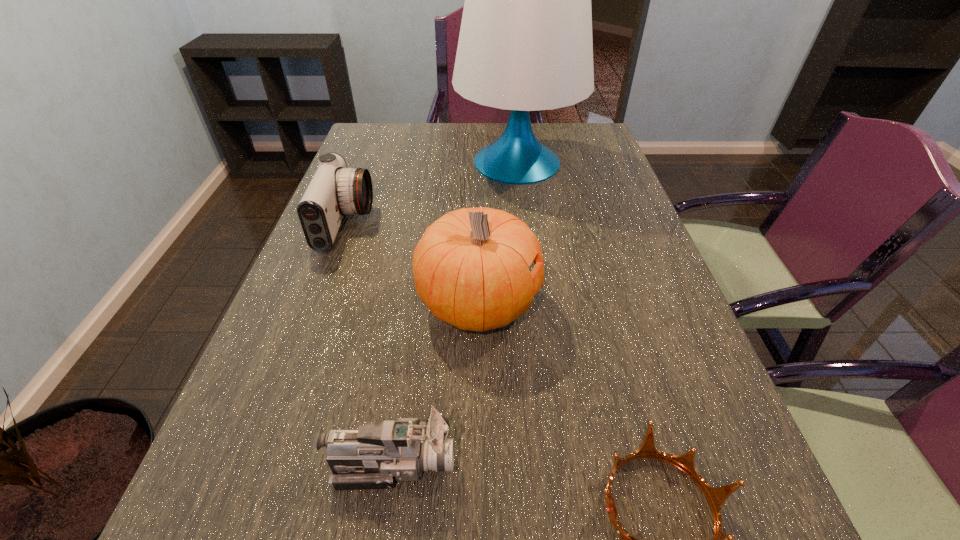
I want to click on vacant area that lies between the pumpkin and the fourth tallest object, so click(435, 383).

Locate an element on the screen. free point between the taller camcorder and the second shortest object is located at coordinates (369, 344).

At what (x,y) coordinates should I click in order to perform the action: click on free space between the farther camcorder and the nearer camcorder. Please return your answer as a coordinate pair (x, y). Image resolution: width=960 pixels, height=540 pixels. Looking at the image, I should click on (369, 344).

The width and height of the screenshot is (960, 540). Find the location of `object that stands as the third closest to the farther camcorder`. object that stands as the third closest to the farther camcorder is located at coordinates (371, 457).

Identify which object is located as the fourth nearest to the pumpkin. Please provide its 2D coordinates. Your answer should be formatted as a tuple, i.e. [(x, y)], where the tuple contains the x and y coordinates of a point satisfying the conditions above.

[(525, 44)]

The image size is (960, 540). What are the coordinates of `free space that satisfies the following two spatial constraints: 1. on the front-facing side of the tallest object; 2. on the front-facing side of the right camcorder` in the screenshot? It's located at (556, 463).

The height and width of the screenshot is (540, 960). Identify the location of free point that satisfies the following two spatial constraints: 1. on the front-facing side of the table lamp; 2. on the surface of the farther camcorder. (526, 225).